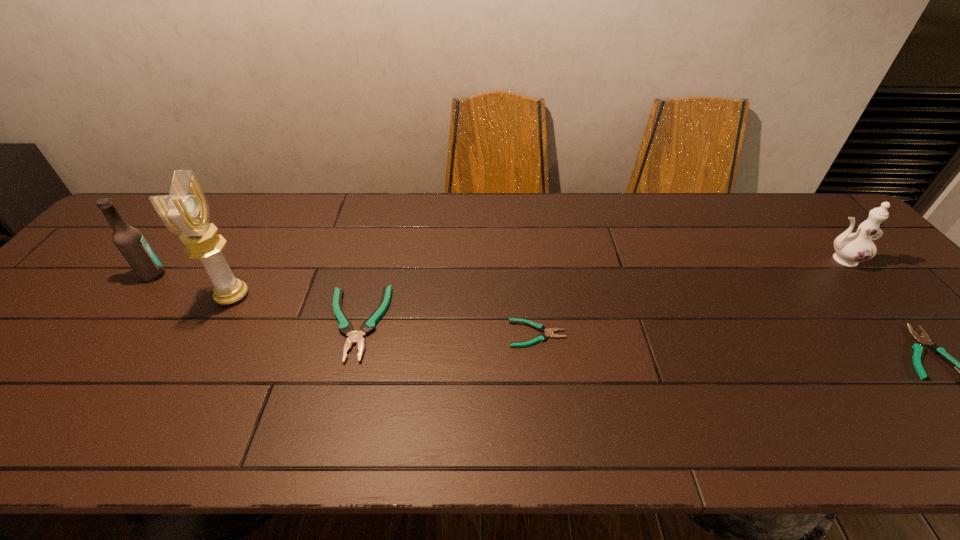
This screenshot has height=540, width=960. What are the coordinates of `vacant space situated 0.090m on the front of the third object from right to left` in the screenshot? It's located at (543, 382).

Find the location of a particular element. The width and height of the screenshot is (960, 540). blank space located 0.400m on the label of the beer bottle is located at coordinates pos(313,275).

Where is `vacant space located 0.180m on the front-facing side of the tallest object`? vacant space located 0.180m on the front-facing side of the tallest object is located at coordinates (319, 296).

At what (x,y) coordinates should I click in order to perform the action: click on free location located 0.370m at the spout of the chinaware. Please return your answer as a coordinate pair (x, y). The image size is (960, 540). Looking at the image, I should click on (687, 260).

The image size is (960, 540). What are the coordinates of `free region located at the spout of the chinaware` in the screenshot? It's located at (733, 260).

The height and width of the screenshot is (540, 960). In order to click on free space located at the spout of the chinaware in this screenshot , I will do `click(737, 260)`.

In order to click on object that is at the right edge in this screenshot , I will do `click(851, 248)`.

What are the coordinates of `vacant position at the far edge of the desktop` in the screenshot? It's located at (666, 230).

Locate an element on the screen. This screenshot has width=960, height=540. vacant space at the near edge of the desktop is located at coordinates tap(658, 394).

In the image, there is a desktop. Find the location of `vacant space at the right edge`. vacant space at the right edge is located at coordinates (915, 300).